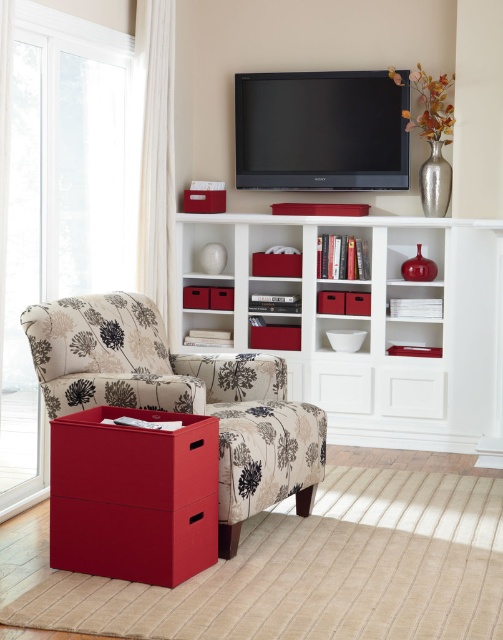
You are standing in the living room and want to exit through the transparent glass door at left. However, you are currently sitting on the floral fabric armchair at left. Can you easily stand up and walk to the door without needing to move the chair?

The transparent glass door at left is taller than the floral fabric armchair at left, so yes, you can easily stand up and walk to the door without needing to move the chair since the door is taller and provides enough clearance.